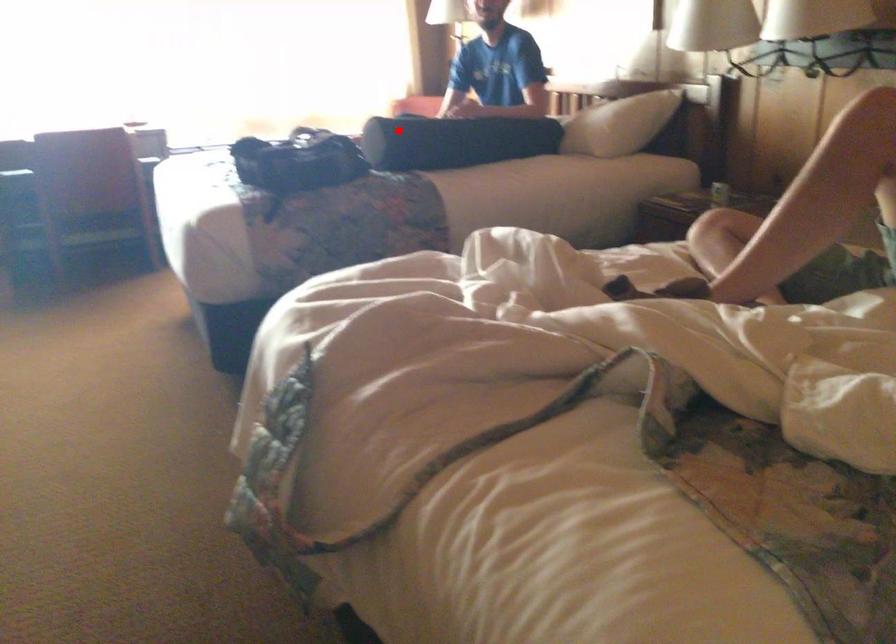
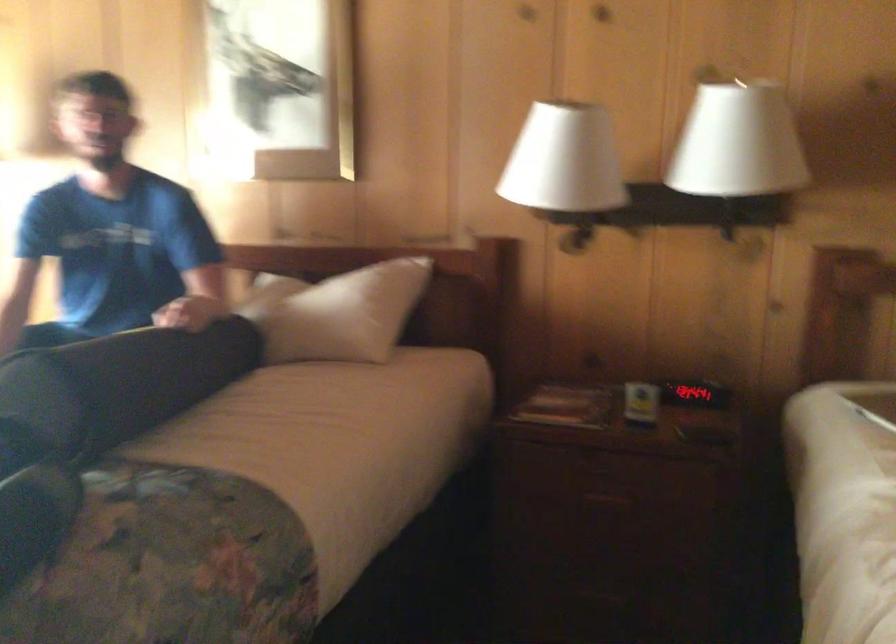
Question: I am providing you with two images of the same scene from different viewpoints. In image1, a red point is highlighted. Considering the same 3D point in image2, which of the following is correct?

Choices:
 (A) It is closer
 (B) It is farther

Answer: (A)